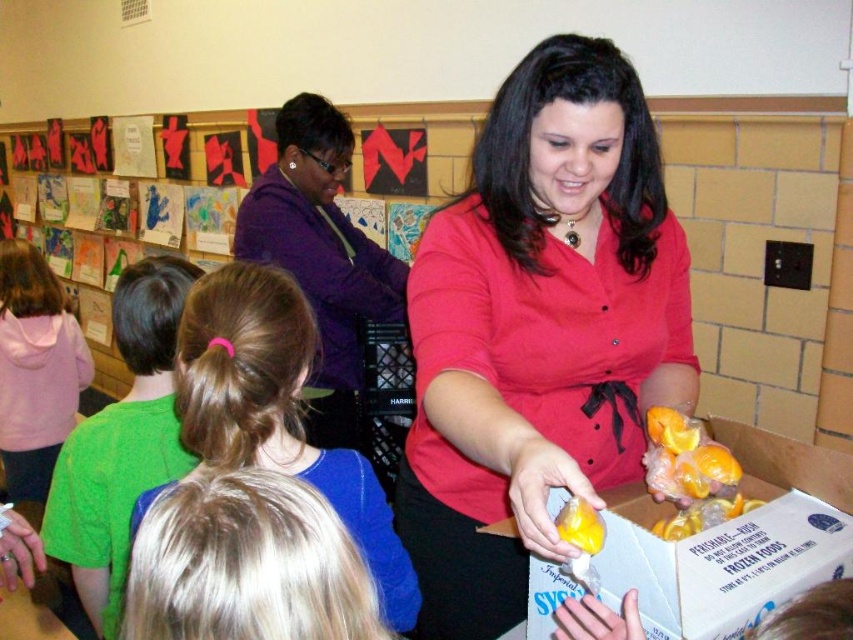
Question: Among these objects, which one is nearest to the camera?

Choices:
 (A) yellow rubber glove at lower center
 (B) blonde hair ponytail at center

Answer: (A)

Question: Is yellow plastic oranges at center to the right of yellow rubber glove at lower center from the viewer's perspective?

Choices:
 (A) yes
 (B) no

Answer: (A)

Question: In this image, where is white cardboard box at lower right located relative to yellow plastic bag at center?

Choices:
 (A) right
 (B) left

Answer: (B)

Question: Estimate the real-world distances between objects in this image. Which object is closer to the blonde hair ponytail at center?

Choices:
 (A) yellow plastic oranges at center
 (B) matte red blouse at center
 (C) pink fleece hoodie at upper left

Answer: (B)

Question: Is purple soft sweater at upper left wider than yellow plastic oranges at center?

Choices:
 (A) no
 (B) yes

Answer: (B)

Question: Among these points, which one is farthest from the camera?

Choices:
 (A) (824, 572)
 (B) (308, 234)
 (C) (187, 337)

Answer: (B)